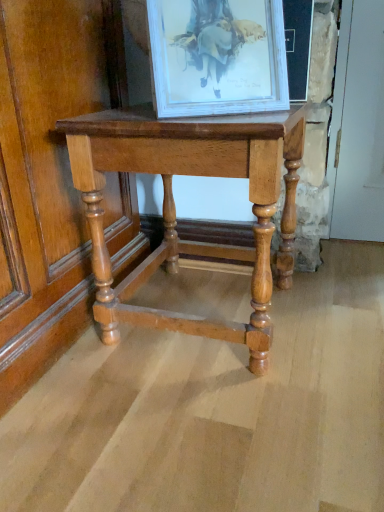
The height and width of the screenshot is (512, 384). I want to click on polished wood table at center, so click(175, 208).

Describe the element at coordinates (175, 208) in the screenshot. The height and width of the screenshot is (512, 384). I see `polished wood table at center` at that location.

The width and height of the screenshot is (384, 512). What do you see at coordinates (217, 57) in the screenshot?
I see `white glossy picture frame at upper center` at bounding box center [217, 57].

The width and height of the screenshot is (384, 512). I want to click on white glossy picture frame at upper center, so click(x=217, y=57).

Find the location of a particular element. The width and height of the screenshot is (384, 512). polished wood table at center is located at coordinates (175, 208).

Which is more to the left, polished wood table at center or white glossy picture frame at upper center?

From the viewer's perspective, polished wood table at center appears more on the left side.

Which object is closer to the camera taking this photo, polished wood table at center or white glossy picture frame at upper center?

white glossy picture frame at upper center is in front.

Considering the points (269, 202) and (231, 63), which point is in front, point (269, 202) or point (231, 63)?

The point (269, 202) is more forward.

From the image's perspective, is polished wood table at center located above or below white glossy picture frame at upper center?

Based on their image positions, polished wood table at center is located beneath white glossy picture frame at upper center.

Consider the image. From a real-world perspective, between polished wood table at center and white glossy picture frame at upper center, who is vertically higher?

white glossy picture frame at upper center, from a real-world perspective.

Can you confirm if polished wood table at center is wider than white glossy picture frame at upper center?

Yes, polished wood table at center is wider than white glossy picture frame at upper center.

Considering the relative sizes of polished wood table at center and white glossy picture frame at upper center in the image provided, is polished wood table at center shorter than white glossy picture frame at upper center?

Incorrect, the height of polished wood table at center does not fall short of that of white glossy picture frame at upper center.

Which of these two, polished wood table at center or white glossy picture frame at upper center, is bigger?

polished wood table at center.

Choose the correct answer: Is polished wood table at center inside white glossy picture frame at upper center or outside it?

polished wood table at center is spatially situated outside white glossy picture frame at upper center.

Is polished wood table at center in contact with white glossy picture frame at upper center?

No, polished wood table at center is not beside white glossy picture frame at upper center.

Could you tell me if polished wood table at center is facing white glossy picture frame at upper center?

No.

The width and height of the screenshot is (384, 512). Identify the location of table on the left of white glossy picture frame at upper center. (175, 208).

Which is more to the right, white glossy picture frame at upper center or polished wood table at center?

white glossy picture frame at upper center.

Between white glossy picture frame at upper center and polished wood table at center, which one is positioned in front?

white glossy picture frame at upper center is closer to the camera.

Which point is more forward, (x=210, y=36) or (x=291, y=190)?

The point (x=210, y=36) is more forward.

From the image's perspective, which one is positioned lower, white glossy picture frame at upper center or polished wood table at center?

polished wood table at center, from the image's perspective.

Looking at this image, from a real-world perspective, between white glossy picture frame at upper center and polished wood table at center, who is vertically higher?

white glossy picture frame at upper center is physically above.

Can you confirm if white glossy picture frame at upper center is thinner than polished wood table at center?

Indeed, white glossy picture frame at upper center has a lesser width compared to polished wood table at center.

In the scene shown: Does white glossy picture frame at upper center have a greater height compared to polished wood table at center?

No.

Between white glossy picture frame at upper center and polished wood table at center, which one has smaller size?

white glossy picture frame at upper center.

Is white glossy picture frame at upper center outside of polished wood table at center?

Indeed, white glossy picture frame at upper center is completely outside polished wood table at center.

Are white glossy picture frame at upper center and polished wood table at center making contact?

No, white glossy picture frame at upper center is not with polished wood table at center.

Could you tell me if white glossy picture frame at upper center is facing polished wood table at center?

No, white glossy picture frame at upper center is not facing towards polished wood table at center.

How different are the orientations of white glossy picture frame at upper center and polished wood table at center in degrees?

white glossy picture frame at upper center and polished wood table at center are facing 29.9 degrees away from each other.

How far apart are white glossy picture frame at upper center and polished wood table at center?

The distance of white glossy picture frame at upper center from polished wood table at center is 8.27 inches.

The width and height of the screenshot is (384, 512). Identify the location of table on the left of white glossy picture frame at upper center. (175, 208).

The image size is (384, 512). I want to click on table that is behind the white glossy picture frame at upper center, so click(x=175, y=208).

Where is `picture frame positioned vertically above the polished wood table at center (from a real-world perspective)`? The image size is (384, 512). picture frame positioned vertically above the polished wood table at center (from a real-world perspective) is located at coordinates (217, 57).